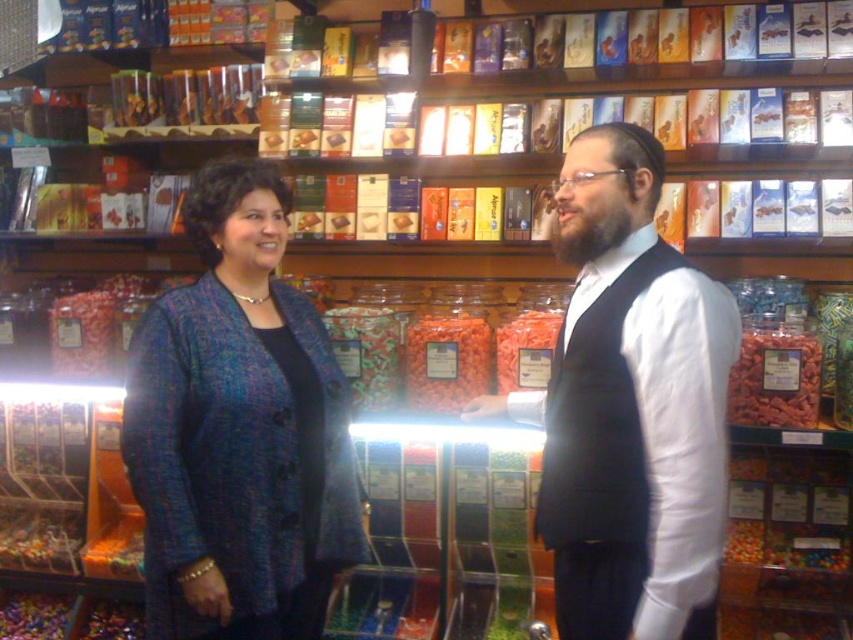
You are a salesperson in the candy store and need to hand a sample to the customer. The customer is wearing the blue textured blazer at center and the matte black vest at center. Which clothing item should you approach to target the customer effectively?

The matte black vest at center is behind the blue textured blazer at center, so you should approach the blue textured blazer at center to target the customer effectively since it is in front and likely closer to you.

In the scene shown: Please describe the location of the blue textured blazer at center in the candy store scene using coordinates. The scene has a coordinate system where the bottom left corner is the origin point.

The blue textured blazer at center is located at coordinates approximately 67.3 percent in the x axis and 28.0 percent in the y axis.

You are a tailor who needs to determine which clothing item requires more fabric for alterations. Based on the image, which clothing item has a larger size between the blue textured blazer at center and the matte black vest at center?

The matte black vest at center has a larger size than the blue textured blazer at center, so it would require more fabric for alterations.